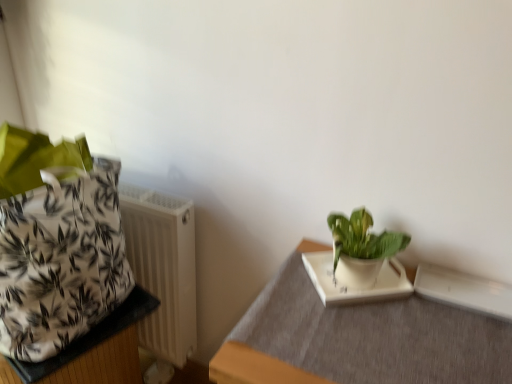
Question: Is green glossy plant at upper right bigger or smaller than white matte flowerpot at left?

Choices:
 (A) big
 (B) small

Answer: (B)

Question: Is green glossy plant at upper right taller or shorter than white matte flowerpot at left?

Choices:
 (A) tall
 (B) short

Answer: (B)

Question: Considering the real-world distances, which object is closest to the white matte flowerpot at left?

Choices:
 (A) white plastic radiator at left
 (B) white fabric bag at left, which is the 2th table from right to left
 (C) green glossy plant at upper right
 (D) white matte tray at lower right, which is the second table in left-to-right order

Answer: (B)

Question: Estimate the real-world distances between objects in this image. Which object is closer to the white fabric bag at left, which is the 2th table from right to left?

Choices:
 (A) green glossy plant at upper right
 (B) white matte tray at lower right, which is the second table in left-to-right order
 (C) white matte flowerpot at left
 (D) white plastic radiator at left

Answer: (C)